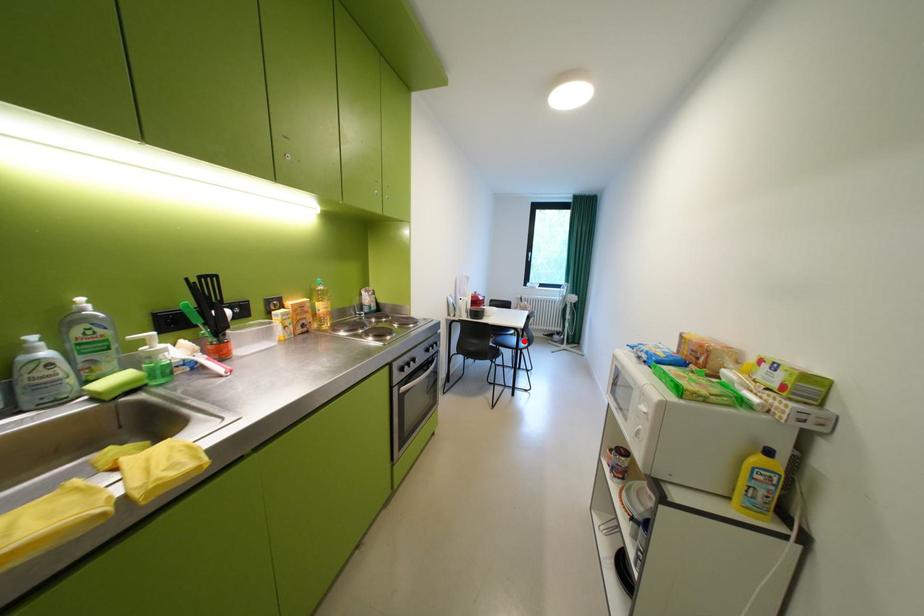
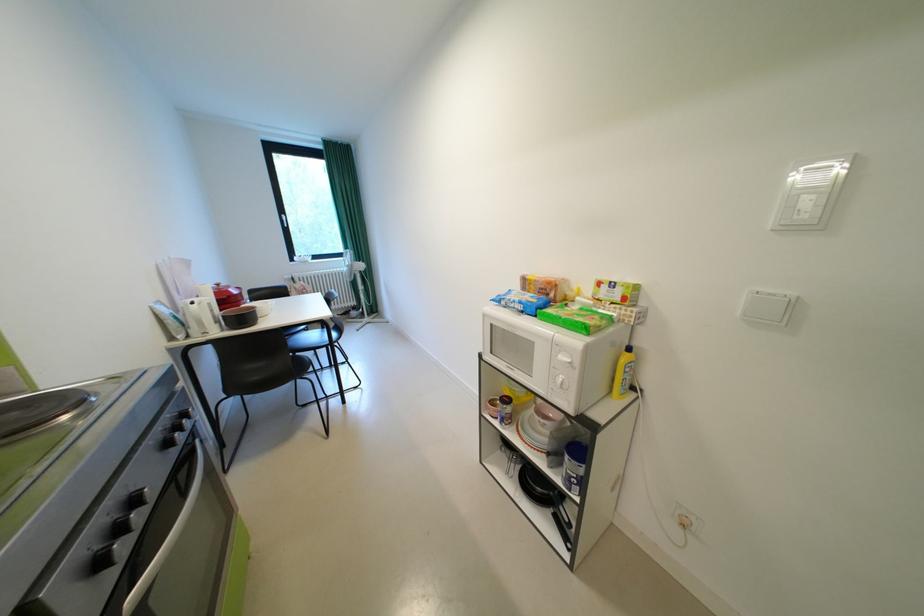
Question: I am providing you with two images of the same scene from different viewpoints. A red point is marked on the first image. Is the red point's position out of view in image 2?

Choices:
 (A) Yes
 (B) No

Answer: (B)